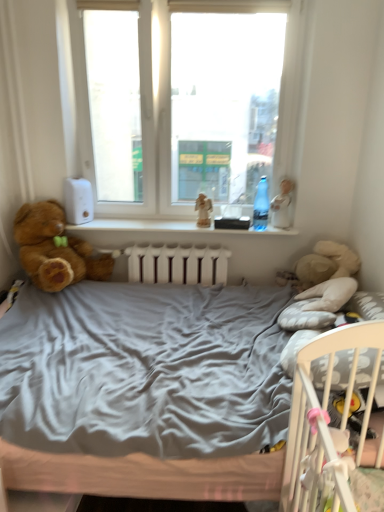
Question: Which is correct: transparent plastic bottle at window is inside transparent glass window at center, or outside of it?

Choices:
 (A) outside
 (B) inside

Answer: (B)

Question: Is transparent plastic bottle at window taller or shorter than transparent glass window at center?

Choices:
 (A) tall
 (B) short

Answer: (B)

Question: Which of these objects is positioned closest to the wooden angel at center?

Choices:
 (A) transparent glass window at center
 (B) white porcelain doll at upper right
 (C) brown plush teddy bear at left
 (D) white plastic window sill at center
 (E) transparent plastic bottle at window

Answer: (D)

Question: Estimate the real-world distances between objects in this image. Which object is closer to the transparent plastic bottle at window?

Choices:
 (A) transparent glass window at center
 (B) white porcelain doll at upper right
 (C) brown plush teddy bear at left
 (D) white plastic window sill at center
 (E) wooden angel at center

Answer: (B)